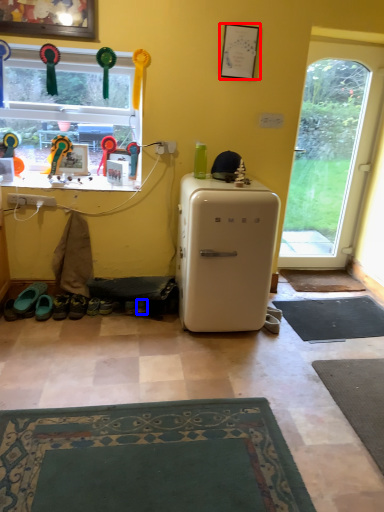
Question: Which of the following is the farthest to the observer, picture frame (highlighted by a red box) or shoe (highlighted by a blue box)?

Choices:
 (A) picture frame
 (B) shoe

Answer: (B)